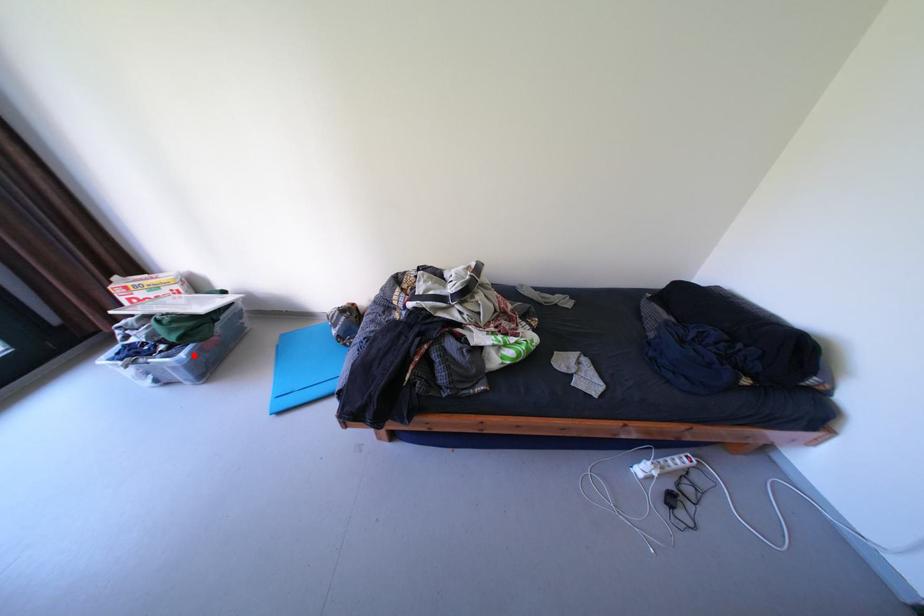
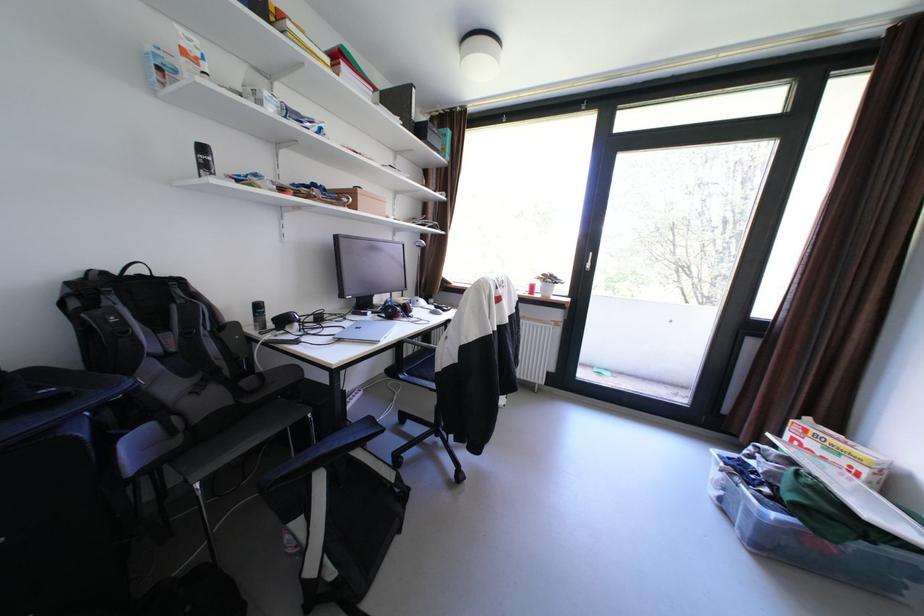
Question: A red point is marked in image1. In image2, is the corresponding 3D point closer to the camera or farther? Reply with the corresponding letter.

Choices:
 (A) The corresponding 3D point is closer.
 (B) The corresponding 3D point is farther.

Answer: (A)